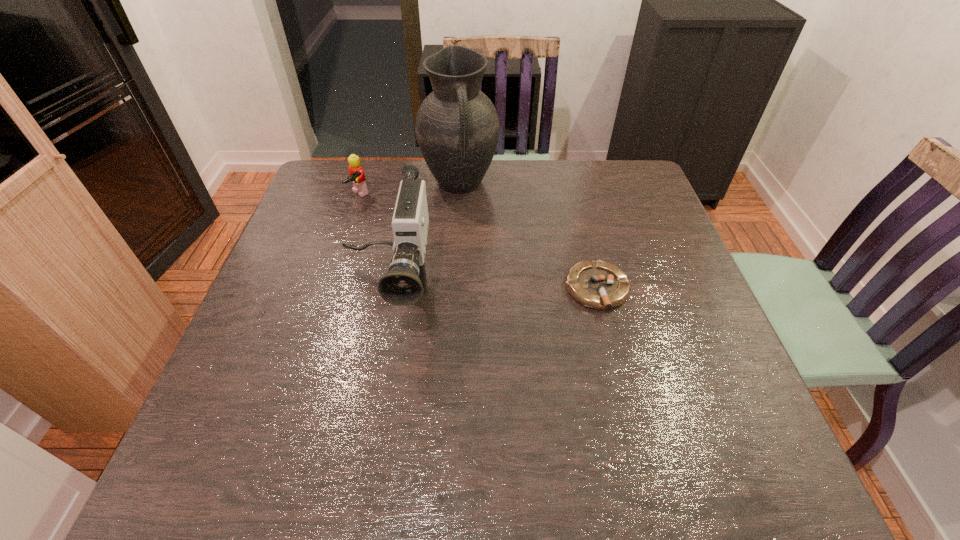
You are a GUI agent. You are given a task and a screenshot of the screen. Output one action in this format:
    pyautogui.click(x=<x>, y=<y>)
    Task: Click on the free location located in front of the Lego with the accessory visible
    The height and width of the screenshot is (540, 960).
    Given the screenshot: What is the action you would take?
    pyautogui.click(x=412, y=236)

Where is `free location located in front of the Lego with the accessory visible`? The image size is (960, 540). free location located in front of the Lego with the accessory visible is located at coordinates (378, 214).

The height and width of the screenshot is (540, 960). What are the coordinates of `free space located in front of the Lego with the accessory visible` in the screenshot? It's located at (404, 231).

Find the location of a particular element. This screenshot has width=960, height=540. pitcher located in the far edge section of the desktop is located at coordinates (457, 129).

Find the location of `Lego that is at the far edge`. Lego that is at the far edge is located at coordinates (357, 177).

Locate an element on the screen. The height and width of the screenshot is (540, 960). object that is at the left edge is located at coordinates (357, 177).

Where is `object situated at the right edge`? object situated at the right edge is located at coordinates (599, 285).

Where is `object at the far left corner`? Image resolution: width=960 pixels, height=540 pixels. object at the far left corner is located at coordinates [357, 177].

The width and height of the screenshot is (960, 540). Identify the location of free space at the far edge of the desktop. (401, 179).

At what (x,y) coordinates should I click in order to perform the action: click on free region at the near edge. Please return your answer as a coordinate pair (x, y). This screenshot has height=540, width=960. Looking at the image, I should click on tap(634, 416).